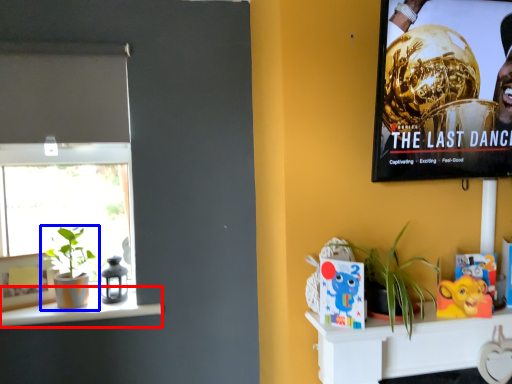
Question: Which object is closer to the camera taking this photo, window sill (highlighted by a red box) or houseplant (highlighted by a blue box)?

Choices:
 (A) window sill
 (B) houseplant

Answer: (A)